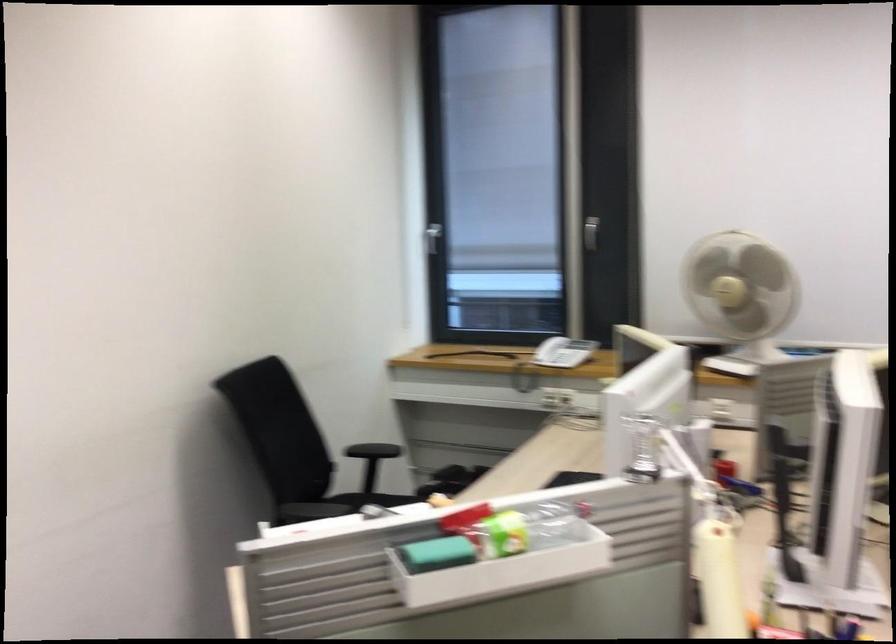
Identify the location of small silver trophy. (642, 448).